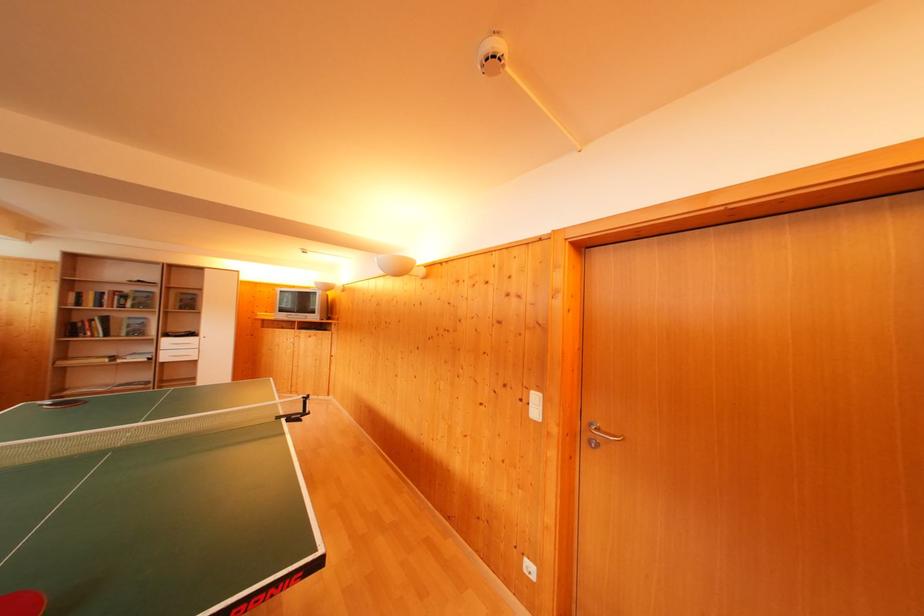
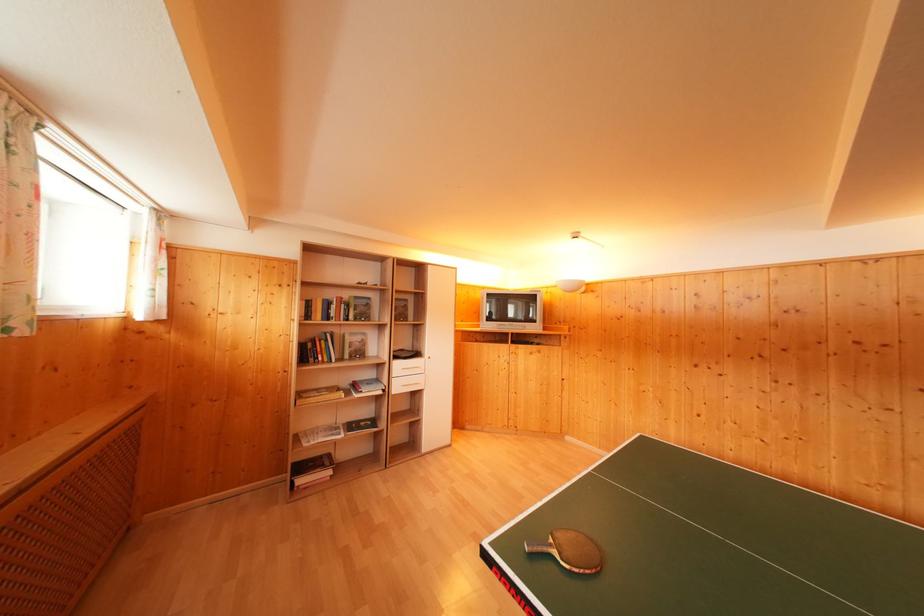
Find the pixel in the second image that matches pixel 152 381 in the first image.

(371, 416)